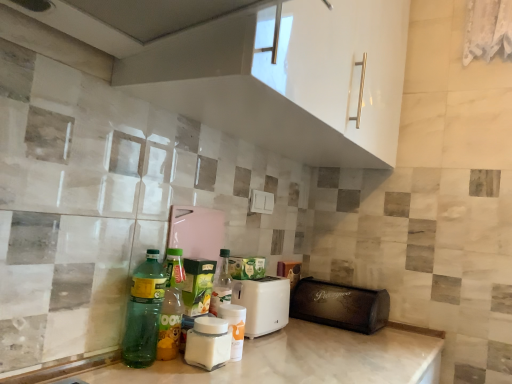
Question: From the image's perspective, is green translucent bottle at lower left, the 1th bottle when ordered from left to right, below white glossy jar at center, marked as the first bottle in a right-to-left arrangement?

Choices:
 (A) yes
 (B) no

Answer: (B)

Question: Is green translucent bottle at lower left, the 1th bottle when ordered from left to right, to the left of white glossy jar at center, marked as the first bottle in a right-to-left arrangement, from the viewer's perspective?

Choices:
 (A) no
 (B) yes

Answer: (B)

Question: Would you say green translucent bottle at lower left, the 1th bottle when ordered from left to right, is a long distance from white glossy jar at center, marked as the first bottle in a right-to-left arrangement?

Choices:
 (A) no
 (B) yes

Answer: (A)

Question: Considering the relative positions of green translucent bottle at lower left, which is counted as the fourth bottle, starting from the right, and white glossy jar at center, marked as the first bottle in a right-to-left arrangement, in the image provided, is green translucent bottle at lower left, which is counted as the fourth bottle, starting from the right, to the right of white glossy jar at center, marked as the first bottle in a right-to-left arrangement, from the viewer's perspective?

Choices:
 (A) no
 (B) yes

Answer: (A)

Question: Is green translucent bottle at lower left, which is counted as the fourth bottle, starting from the right, facing towards white glossy jar at center, marked as the first bottle in a right-to-left arrangement?

Choices:
 (A) yes
 (B) no

Answer: (B)

Question: Is black leather bread bin at lower right, placed as the 2th appliance when sorted from left to right, taller or shorter than white glossy jar at center, the third bottle when ordered from left to right?

Choices:
 (A) tall
 (B) short

Answer: (A)

Question: Considering their positions, is black leather bread bin at lower right, the first appliance from the right, located in front of or behind white glossy jar at center, the 2th bottle viewed from the right?

Choices:
 (A) behind
 (B) front

Answer: (A)

Question: Considering the positions of black leather bread bin at lower right, the first appliance from the right, and white glossy jar at center, the 2th bottle viewed from the right, in the image, is black leather bread bin at lower right, the first appliance from the right, wider or thinner than white glossy jar at center, the 2th bottle viewed from the right,?

Choices:
 (A) thin
 (B) wide

Answer: (B)

Question: Does point (356, 307) appear closer or farther from the camera than point (192, 334)?

Choices:
 (A) closer
 (B) farther

Answer: (B)

Question: In terms of width, does green translucent bottle at lower left, which is counted as the fourth bottle, starting from the right, look wider or thinner when compared to white glossy jar at center, placed as the fourth bottle when sorted from left to right?

Choices:
 (A) thin
 (B) wide

Answer: (B)

Question: In terms of size, does green translucent bottle at lower left, the 1th bottle when ordered from left to right, appear bigger or smaller than white glossy jar at center, placed as the fourth bottle when sorted from left to right?

Choices:
 (A) small
 (B) big

Answer: (B)

Question: Is point (151, 342) closer or farther from the camera than point (234, 322)?

Choices:
 (A) farther
 (B) closer

Answer: (B)

Question: From a real-world perspective, is green translucent bottle at lower left, the 1th bottle when ordered from left to right, above or below white glossy jar at center, placed as the fourth bottle when sorted from left to right?

Choices:
 (A) below
 (B) above

Answer: (B)

Question: Is white glossy jar at center, the 2th bottle viewed from the right, bigger or smaller than green glass bottle at center, positioned as the 3th bottle in right-to-left order?

Choices:
 (A) big
 (B) small

Answer: (B)

Question: Considering the positions of white glossy jar at center, the 2th bottle viewed from the right, and green glass bottle at center, which is the 2th bottle from left to right, in the image, is white glossy jar at center, the 2th bottle viewed from the right, wider or thinner than green glass bottle at center, which is the 2th bottle from left to right,?

Choices:
 (A) thin
 (B) wide

Answer: (B)